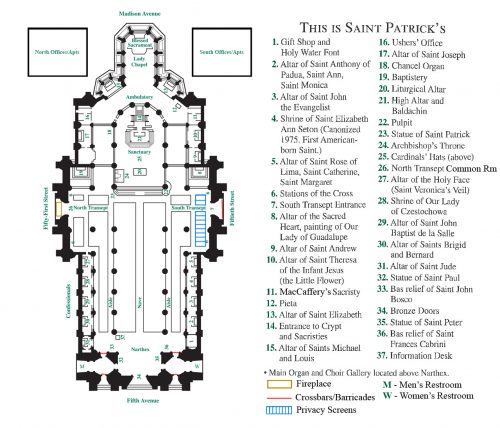
Where is `altar`? altar is located at coordinates (80, 173).